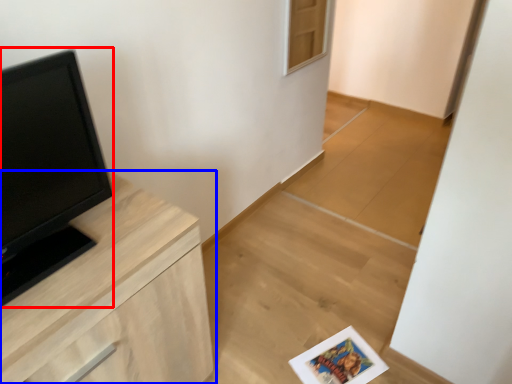
Question: Which point is closer to the camera, open (highlighted by a red box) or chest of drawers (highlighted by a blue box)?

Choices:
 (A) open
 (B) chest of drawers

Answer: (A)